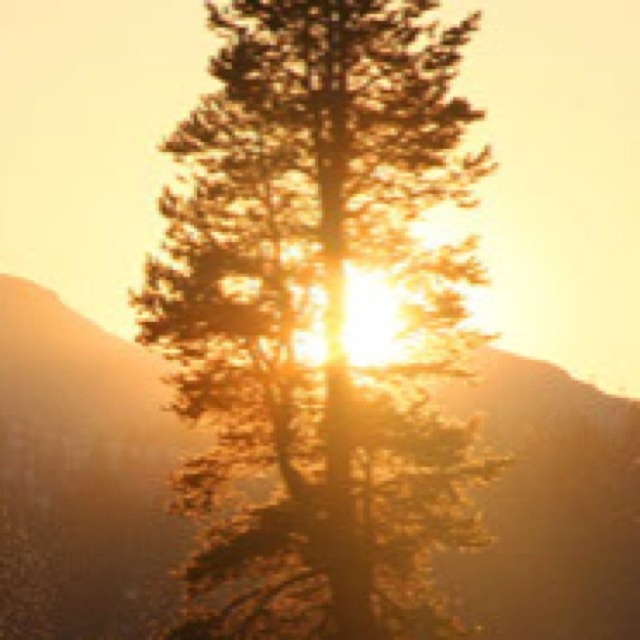
Question: Is brown textured tree at center in front of matte brown mountain at center?

Choices:
 (A) yes
 (B) no

Answer: (A)

Question: Can you confirm if brown textured tree at center is wider than matte brown mountain at center?

Choices:
 (A) yes
 (B) no

Answer: (B)

Question: Is brown textured tree at center bigger than matte brown mountain at center?

Choices:
 (A) no
 (B) yes

Answer: (B)

Question: Which point appears farthest from the camera in this image?

Choices:
 (A) (422, 596)
 (B) (51, 448)

Answer: (B)